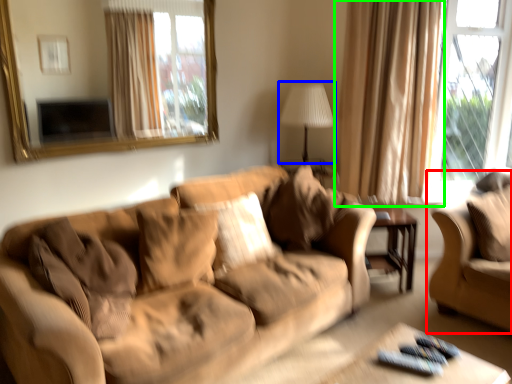
Question: Which is nearer to the studio couch (highlighted by a red box)? table lamp (highlighted by a blue box) or curtain (highlighted by a green box).

Choices:
 (A) table lamp
 (B) curtain

Answer: (B)